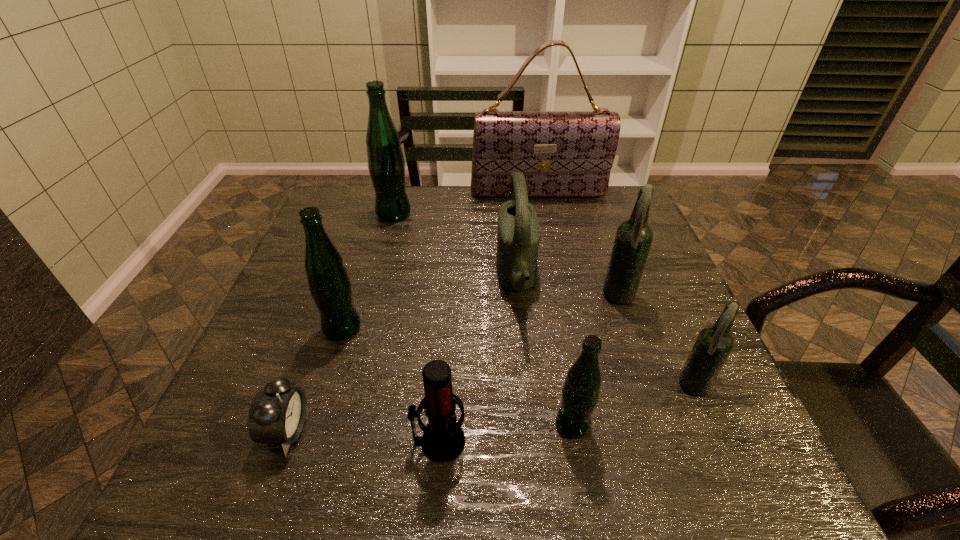
In order to click on object that is the sixth closest to the microphone in this screenshot , I will do `click(633, 239)`.

Where is `beer bottle that can be found as the second closest to the watering can`? The width and height of the screenshot is (960, 540). beer bottle that can be found as the second closest to the watering can is located at coordinates (580, 393).

This screenshot has width=960, height=540. What are the coordinates of `beer bottle that can be found as the third closest to the tallest object` in the screenshot? It's located at (329, 284).

The height and width of the screenshot is (540, 960). What are the coordinates of `green beer bottle that is the nearest to the farther dark beer bottle` in the screenshot? It's located at (580, 393).

Select which green beer bottle is the second closest to the nearest beer bottle. Please provide its 2D coordinates. Your answer should be formatted as a tuple, i.e. [(x, y)], where the tuple contains the x and y coordinates of a point satisfying the conditions above.

[(386, 165)]

At what (x,y) coordinates should I click in order to perform the action: click on blank space that satisfies the following two spatial constraints: 1. on the spout of the green watering can; 2. on the back side of the nearer dark beer bottle. Please return your answer as a coordinate pair (x, y). Image resolution: width=960 pixels, height=540 pixels. Looking at the image, I should click on (527, 387).

The image size is (960, 540). I want to click on free location that satisfies the following two spatial constraints: 1. on the front of the handbag with the clasp; 2. on the right side of the fourth nearest object, so click(576, 387).

This screenshot has width=960, height=540. In order to click on vacant space that satisfies the following two spatial constraints: 1. on the front side of the second biggest green beer bottle; 2. on the left side of the microphone in this screenshot , I will do `click(306, 441)`.

Find the location of a particular element. The width and height of the screenshot is (960, 540). free space that satisfies the following two spatial constraints: 1. on the front side of the red microphone; 2. on the left side of the alarm clock is located at coordinates (x=283, y=441).